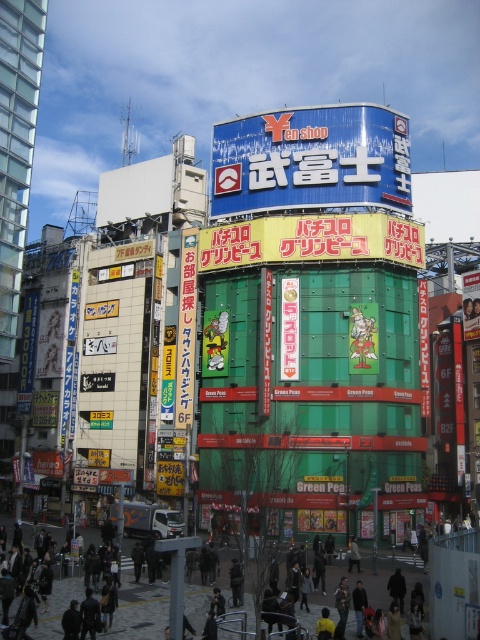
You are a photographer standing in front of the large building with the blue sign. You notice a dark gray jacket at center and a green matte sign at center. Which object is taller?

The dark gray jacket at center is taller than the green matte sign at center.

You are a tourist in Japan and see the dark gray jacket at center and the green matte sign at center. Which object is closer to the ground?

The dark gray jacket at center is located below the green matte sign at center, so it is closer to the ground than the green matte sign at center.